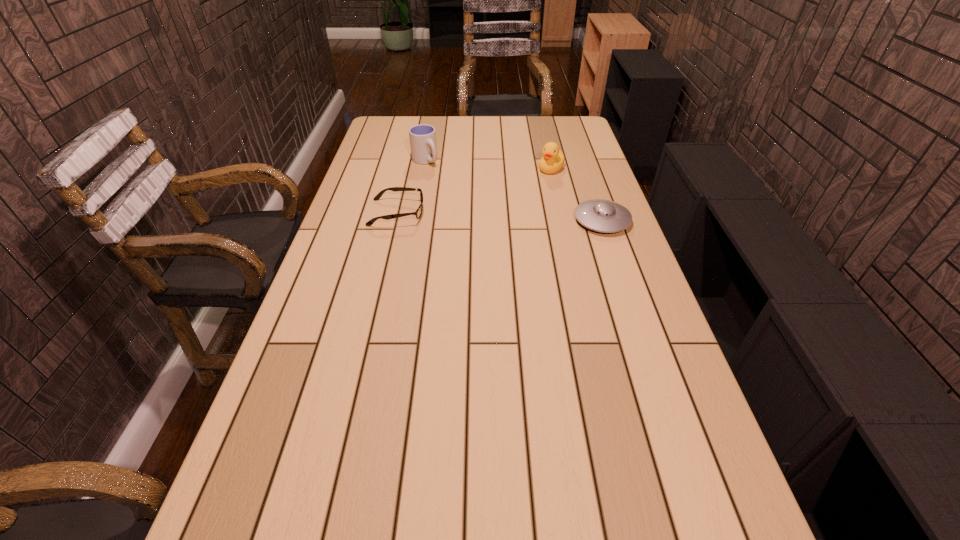
At what (x,y) coordinates should I click in order to perform the action: click on the shortest object. Please return your answer as a coordinate pair (x, y). This screenshot has height=540, width=960. Looking at the image, I should click on click(418, 213).

This screenshot has height=540, width=960. I want to click on the third tallest object, so pyautogui.click(x=600, y=215).

This screenshot has height=540, width=960. Identify the location of cup. (422, 137).

The height and width of the screenshot is (540, 960). I want to click on duckling, so click(x=553, y=160).

Image resolution: width=960 pixels, height=540 pixels. I want to click on vacant space located on the front-facing side of the spectacles, so click(x=445, y=213).

Where is `free space located 0.200m on the front of the saucer`? The image size is (960, 540). free space located 0.200m on the front of the saucer is located at coordinates (623, 281).

Identify the location of vacant space located with the handle on the side of the cup. (455, 194).

Image resolution: width=960 pixels, height=540 pixels. I want to click on vacant space located 0.170m with the handle on the side of the cup, so click(449, 189).

Where is `vacant region located 0.160m with the handle on the side of the cup`? vacant region located 0.160m with the handle on the side of the cup is located at coordinates (448, 187).

Image resolution: width=960 pixels, height=540 pixels. I want to click on blank space located on the face of the duckling, so click(505, 207).